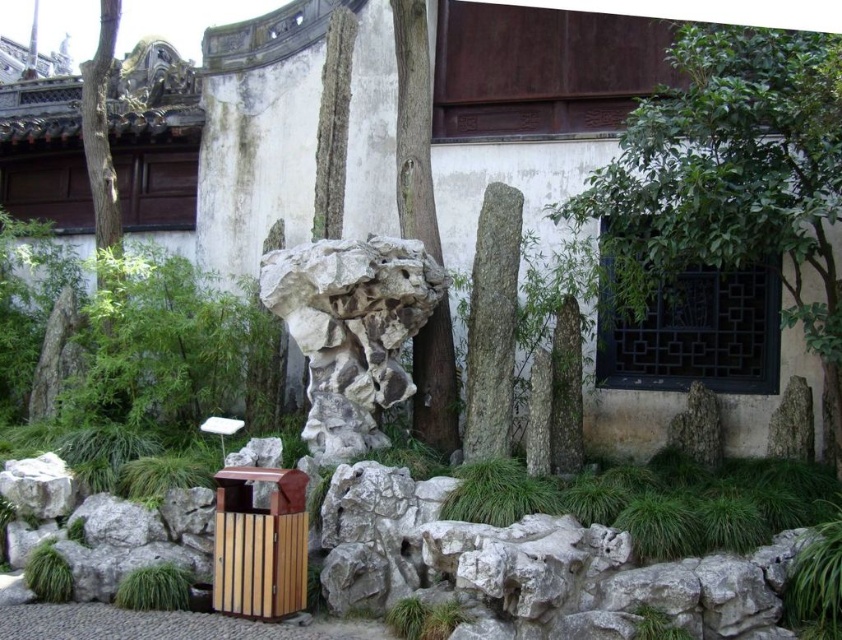
Question: Considering the relative positions of green leafy tree at center and smooth brown tree trunk at center in the image provided, where is green leafy tree at center located with respect to smooth brown tree trunk at center?

Choices:
 (A) right
 (B) left

Answer: (A)

Question: Is white stone rock at center closer to the viewer compared to smooth brown tree trunk at center?

Choices:
 (A) yes
 (B) no

Answer: (A)

Question: Is green leafy tree at center closer to the viewer compared to white stone rock at center?

Choices:
 (A) yes
 (B) no

Answer: (A)

Question: Which object is closer to the camera taking this photo?

Choices:
 (A) smooth brown tree trunk at center
 (B) green leafy tree at center
 (C) white stone rock at center

Answer: (B)

Question: Which object appears closest to the camera in this image?

Choices:
 (A) green leafy tree at center
 (B) white stone rock at center
 (C) smooth brown tree trunk at center

Answer: (A)

Question: Which of the following is the farthest from the observer?

Choices:
 (A) green leafy tree at center
 (B) smooth brown tree trunk at center
 (C) white stone rock at center

Answer: (B)